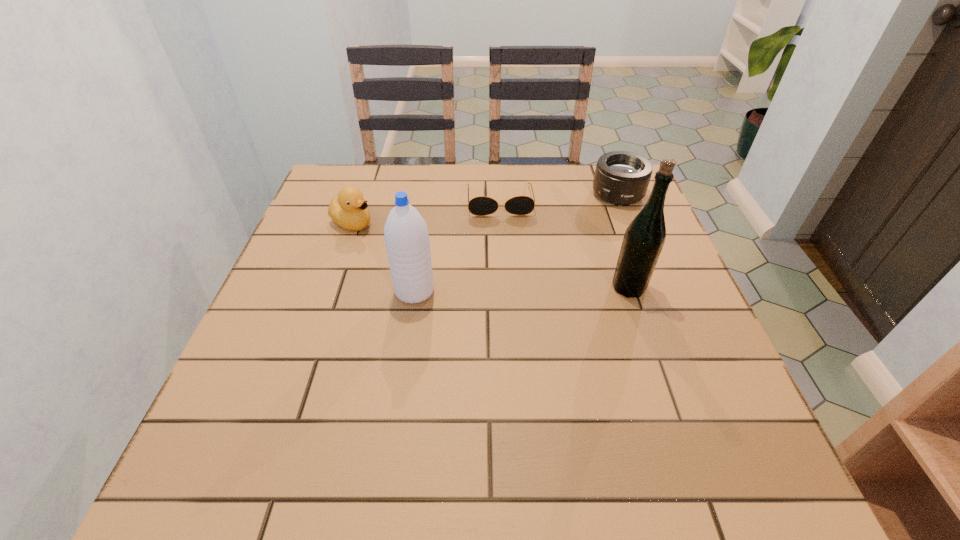
Locate an element on the screen. object at the left edge is located at coordinates (349, 210).

Where is `beer bottle located at the right edge`? The width and height of the screenshot is (960, 540). beer bottle located at the right edge is located at coordinates (644, 238).

Find the location of a particular element. telephoto lens present at the right edge is located at coordinates click(621, 178).

In order to click on object that is at the far right corner in this screenshot , I will do `click(621, 178)`.

Where is `vacant region at the far edge of the desktop`? The width and height of the screenshot is (960, 540). vacant region at the far edge of the desktop is located at coordinates (384, 170).

Locate an element on the screen. blank space at the left edge of the desktop is located at coordinates (340, 310).

You are a GUI agent. You are given a task and a screenshot of the screen. Output one action in this format:
    pyautogui.click(x=<x>, y=<y>)
    Task: Click on the vacant space at the right edge of the desktop
    The image size is (960, 540).
    Given the screenshot: What is the action you would take?
    pyautogui.click(x=595, y=218)

You are a GUI agent. You are given a task and a screenshot of the screen. Output one action in this format:
    pyautogui.click(x=<x>, y=<y>)
    Task: Click on the vacant region at the far left corner
    The width and height of the screenshot is (960, 540).
    Given the screenshot: What is the action you would take?
    pyautogui.click(x=333, y=171)

This screenshot has height=540, width=960. In order to click on vacant area that lies between the second tallest object and the duckling in this screenshot , I will do `click(384, 257)`.

Identify the location of blank region between the fourth object from right to left and the duckling. Image resolution: width=960 pixels, height=540 pixels. (384, 257).